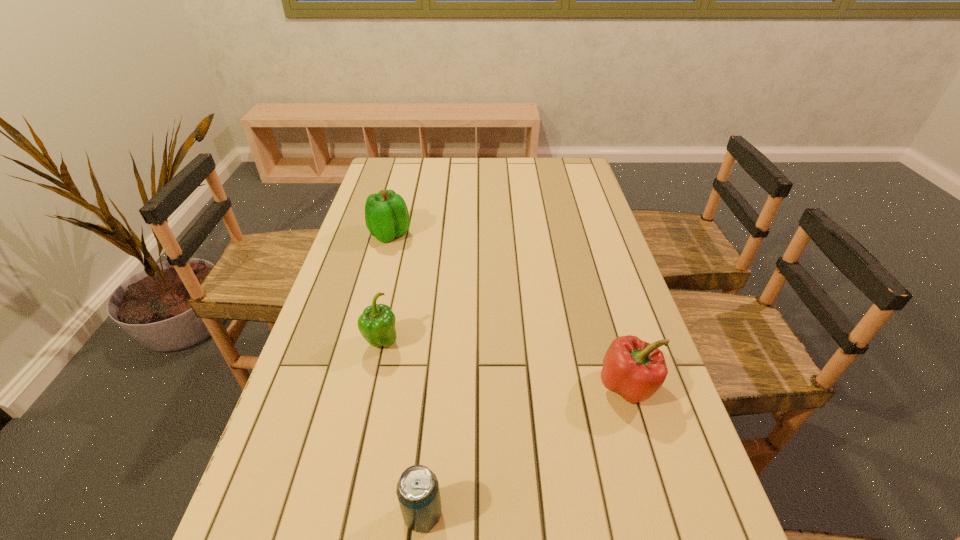
The height and width of the screenshot is (540, 960). In order to click on the farthest object in this screenshot , I will do `click(386, 214)`.

You are a GUI agent. You are given a task and a screenshot of the screen. Output one action in this format:
    pyautogui.click(x=<x>, y=<y>)
    Task: Click on the second farthest object
    The width and height of the screenshot is (960, 540).
    Given the screenshot: What is the action you would take?
    pyautogui.click(x=376, y=324)

The height and width of the screenshot is (540, 960). In order to click on the nearest bell pepper in this screenshot , I will do `click(634, 369)`.

Locate an element on the screen. the rightmost object is located at coordinates [x=634, y=369].

Where is `the nearest object`? The height and width of the screenshot is (540, 960). the nearest object is located at coordinates (418, 493).

I want to click on the second object from right to left, so click(418, 493).

Where is `vacant space located 0.270m on the front of the farthest bell pepper`? vacant space located 0.270m on the front of the farthest bell pepper is located at coordinates (370, 310).

Locate an element on the screen. This screenshot has height=540, width=960. free space located 0.350m on the front of the second nearest bell pepper is located at coordinates [344, 516].

Where is `free space located 0.260m on the back of the nearest bell pepper`? The height and width of the screenshot is (540, 960). free space located 0.260m on the back of the nearest bell pepper is located at coordinates (598, 286).

The image size is (960, 540). In order to click on vacant space located on the left of the soda can in this screenshot , I will do `click(242, 514)`.